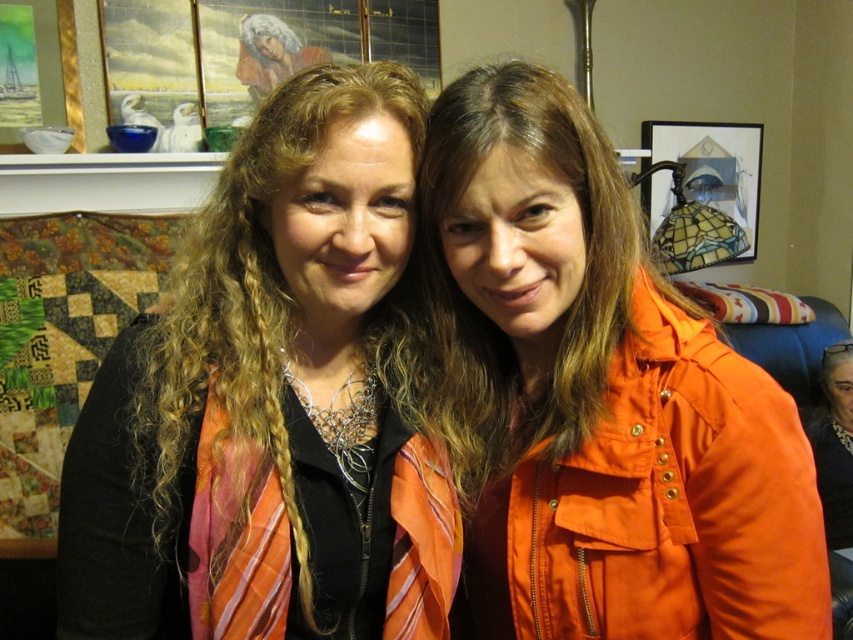
Does orange fabric scarf at left have a greater height compared to orange matte jacket at center?

Yes.

Does point (399, 522) lie behind point (724, 474)?

That is True.

The height and width of the screenshot is (640, 853). I want to click on orange fabric scarf at left, so click(273, 403).

The image size is (853, 640). What are the coordinates of `orange fabric scarf at left` in the screenshot? It's located at (273, 403).